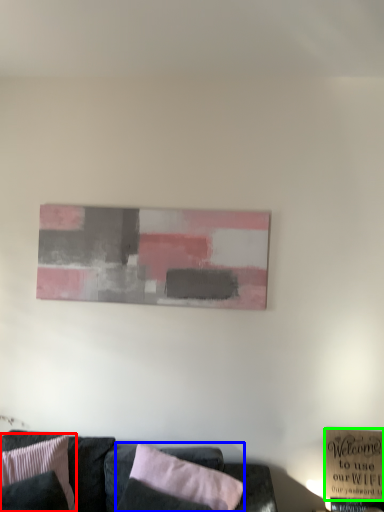
Question: Which object is positioned farthest from pillow (highlighted by a red box)? Select from pillow (highlighted by a blue box) and plaque (highlighted by a green box).

Choices:
 (A) pillow
 (B) plaque

Answer: (B)